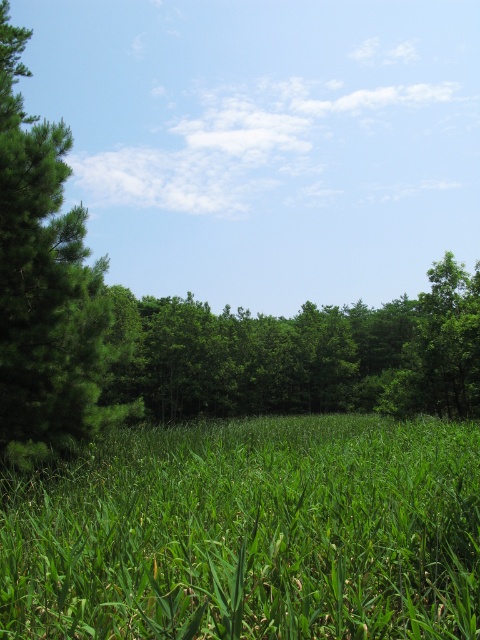
Between point (311, 461) and point (20, 195), which one is positioned behind?

The point (20, 195) is more distant.

Can you confirm if green grassy at center is positioned to the right of green leafy tree at left?

Indeed, green grassy at center is positioned on the right side of green leafy tree at left.

Find the location of `green grassy at center`. green grassy at center is located at coordinates (252, 532).

Where is `green grassy at center`? The height and width of the screenshot is (640, 480). green grassy at center is located at coordinates (252, 532).

Is green grassy at center in front of green leafy tree at center?

Yes, it is in front of green leafy tree at center.

Can you confirm if green grassy at center is taller than green leafy tree at center?

No.

Who is more forward, [336,586] or [118,310]?

Point [336,586] is in front.

Identify the location of green grassy at center. (252, 532).

Who is more distant from viewer, (452, 259) or (81, 440)?

The point (452, 259) is more distant.

Measure the distance between green leafy tree at center and green leafy tree at left.

green leafy tree at center and green leafy tree at left are 69.21 feet apart.

What do you see at coordinates (303, 355) in the screenshot? The width and height of the screenshot is (480, 640). I see `green leafy tree at center` at bounding box center [303, 355].

Where is `green leafy tree at center`? This screenshot has height=640, width=480. green leafy tree at center is located at coordinates (303, 355).